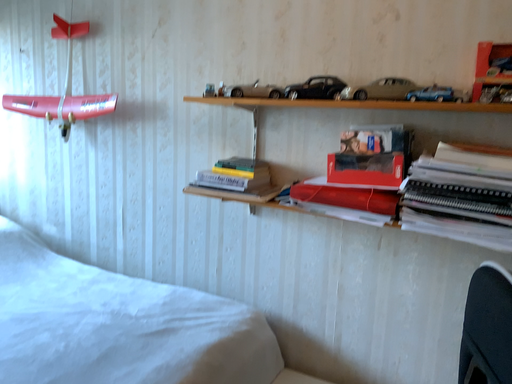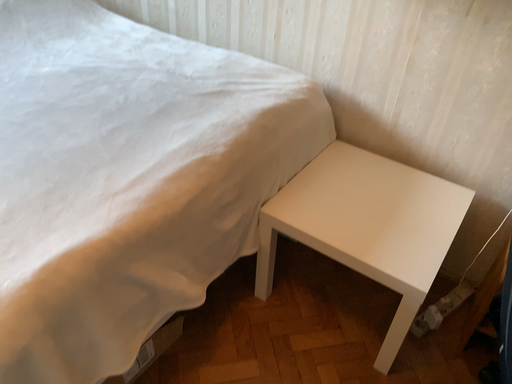
Question: How did the camera likely rotate when shooting the video?

Choices:
 (A) rotated left
 (B) rotated right

Answer: (A)